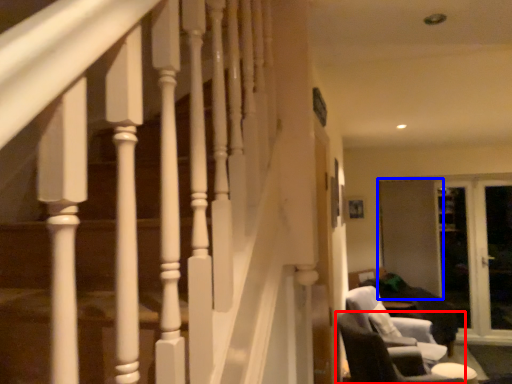
Question: Which object appears farthest to the camera in this image, chair (highlighted by a red box) or screen door (highlighted by a blue box)?

Choices:
 (A) chair
 (B) screen door

Answer: (B)